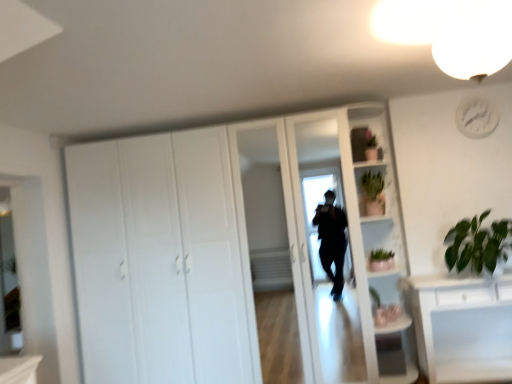
Question: Visually, is green matte plant at right positioned to the left or to the right of white glossy light fixture at upper right?

Choices:
 (A) right
 (B) left

Answer: (A)

Question: In terms of height, does green matte plant at right look taller or shorter compared to white glossy light fixture at upper right?

Choices:
 (A) tall
 (B) short

Answer: (B)

Question: Which of these objects is positioned farthest from the white glossy light fixture at upper right?

Choices:
 (A) white glossy bookshelf at upper right
 (B) green matte plant at right
 (C) green leafy plant at right
 (D) green matte cactus at upper right, the 2th cabinet in the front-to-back sequence
 (E) green matte plant at upper right, the second cabinet ordered from the bottom

Answer: (B)

Question: Which object is positioned closest to the white matte cupboard at center?

Choices:
 (A) clear glass mirror at left
 (B) green matte cactus at upper right, the first cabinet viewed from the back
 (C) white plastic clock at upper right
 (D) white glossy bookshelf at upper right
 (E) green leafy plant at right

Answer: (D)